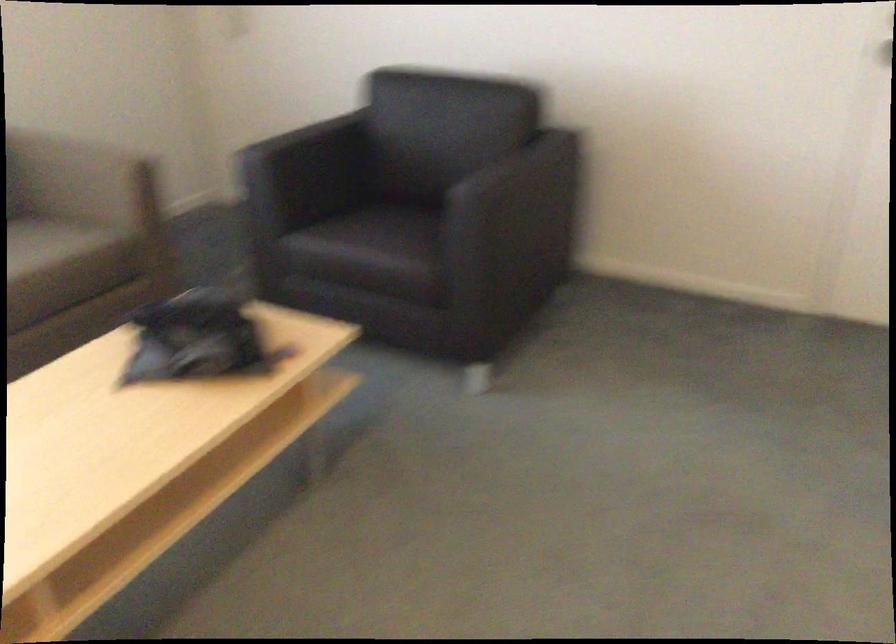
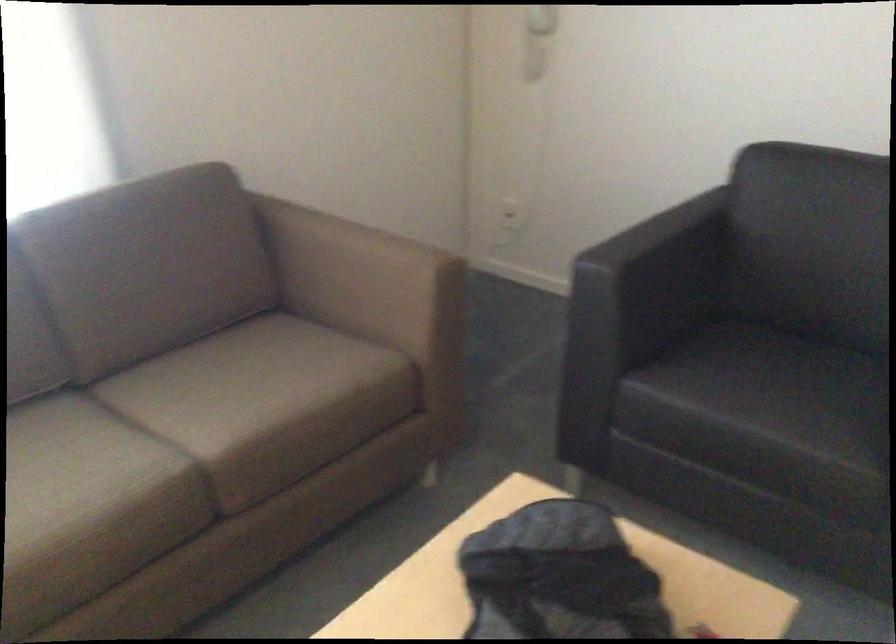
Where in the second image is the point corresponding to point 185,317 from the first image?

(558, 576)